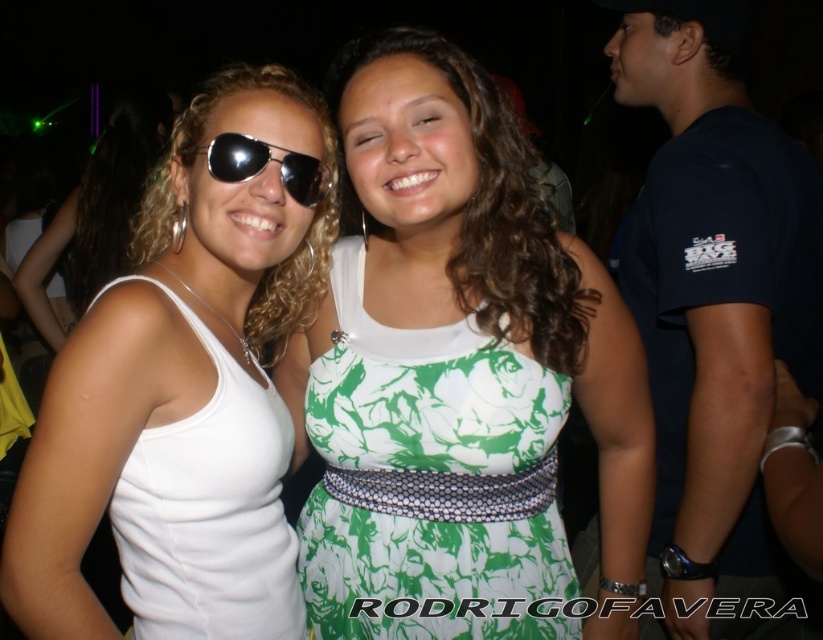
You are at a party and want to take a photo of the green printed dress at center and the shiny black aviator sunglasses at center. Which one should you focus on first if you want to capture both in the same frame without moving the camera?

The green printed dress at center is located below the shiny black aviator sunglasses at center, so you should focus on the shiny black aviator sunglasses at center first to ensure both are in the frame.

You are at a party and want to take a photo of the green floral dress at center and the green floral fabric dress at center. Which one is closer to the camera?

The green floral dress at center is closer to the camera because it is in front of the green floral fabric dress at center.

You are trying to decide which dress to wear to a party. You see two options in the image, the green floral dress at center and the green floral fabric dress at center. Which one is larger?

The green floral dress at center is bigger than the green floral fabric dress at center, so the green floral dress at center is the larger one.